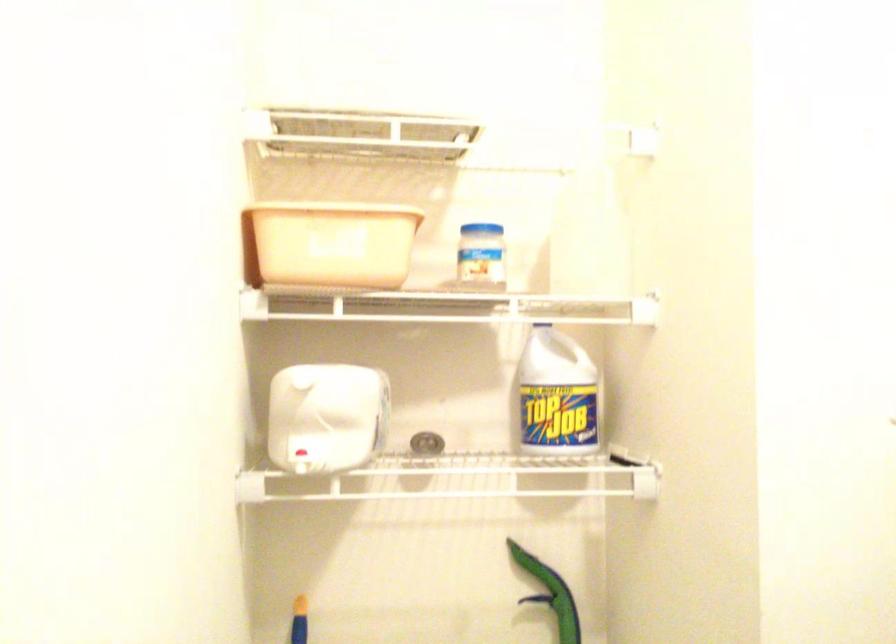
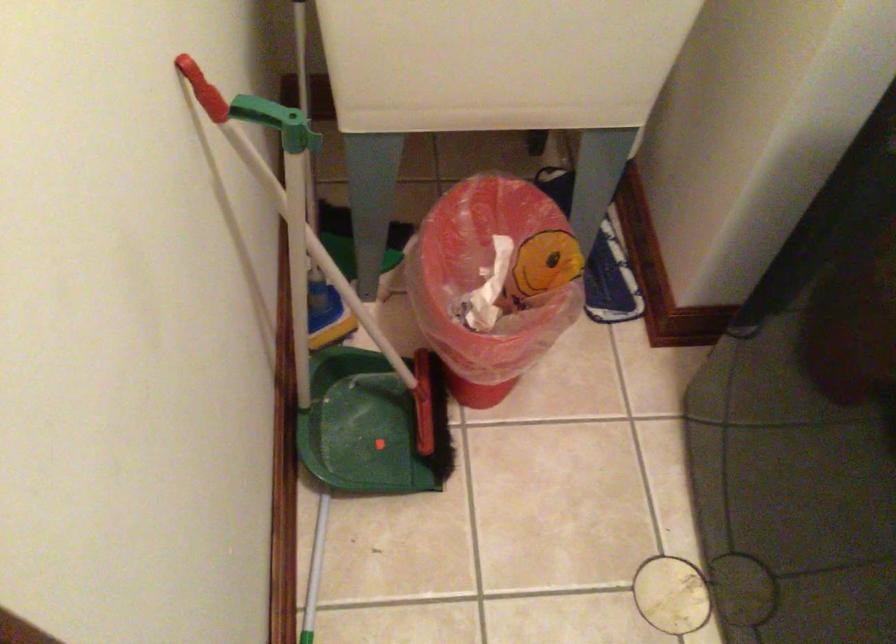
Question: Based on the continuous images, in which direction is the camera rotating? Reply with the corresponding letter.

Choices:
 (A) Left
 (B) Right
 (C) Up
 (D) Down

Answer: (D)